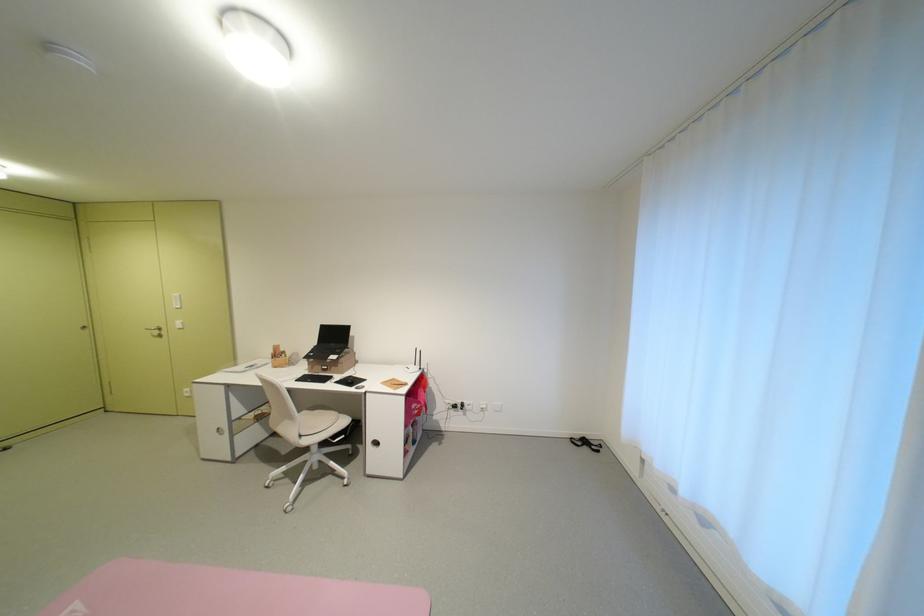
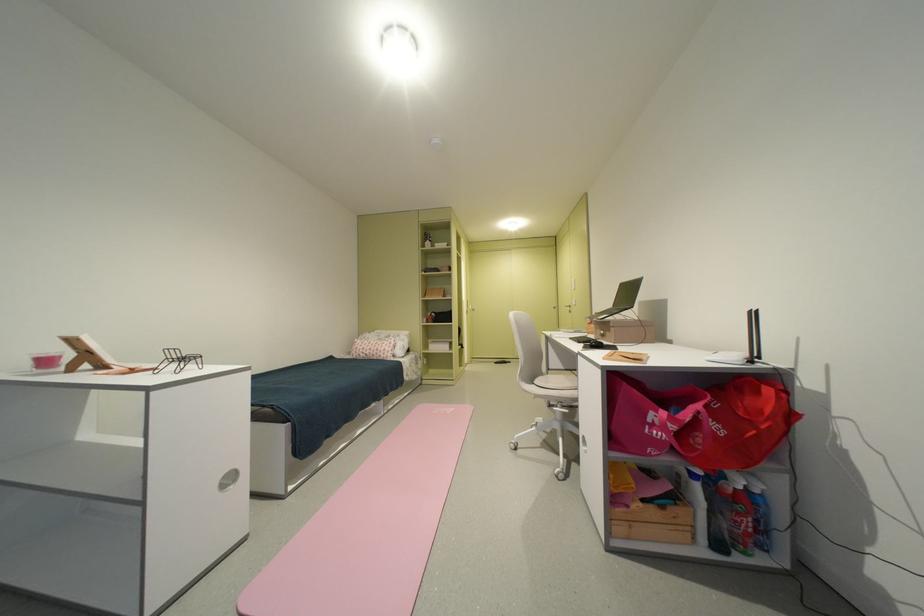
In the second image, find the point that corresponds to pixel 189 329 in the first image.

(584, 305)